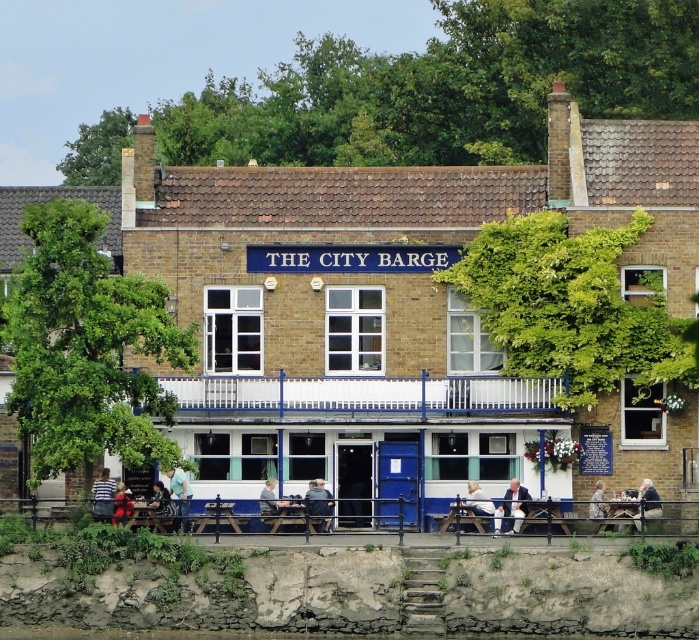
Question: Does light blue fabric jacket at center have a smaller size compared to striped shirt at lower left?

Choices:
 (A) no
 (B) yes

Answer: (A)

Question: Based on their relative distances, which object is farther from the light beige fabric chair at center?

Choices:
 (A) light blue fabric jacket at center
 (B) camouflage fabric jacket at lower right
 (C) striped shirt at lower left
 (D) light brown wooden bench at lower center

Answer: (C)

Question: Where is red fabric jacket at lower left located in relation to camouflage fabric jacket at lower right in the image?

Choices:
 (A) right
 (B) left

Answer: (B)

Question: Does light gray fabric jacket at center appear on the right side of light beige fabric chair at center?

Choices:
 (A) yes
 (B) no

Answer: (B)

Question: Which point appears closest to the camera in this image?

Choices:
 (A) (496, 520)
 (B) (120, 488)
 (C) (468, 497)
 (D) (374, 572)

Answer: (D)

Question: Based on their relative distances, which object is farther from the red fabric jacket at lower left?

Choices:
 (A) light brown wooden bench at lower center
 (B) wooden table at lower center
 (C) striped shirt at lower left

Answer: (B)